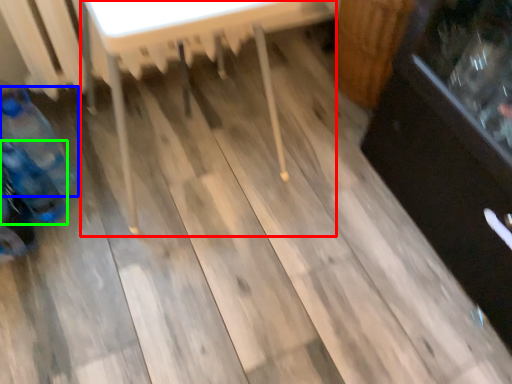
Question: Which object is the closest to the table (highlighted by a red box)? Choose among these: bottle (highlighted by a blue box) or bottle (highlighted by a green box).

Choices:
 (A) bottle
 (B) bottle

Answer: (A)